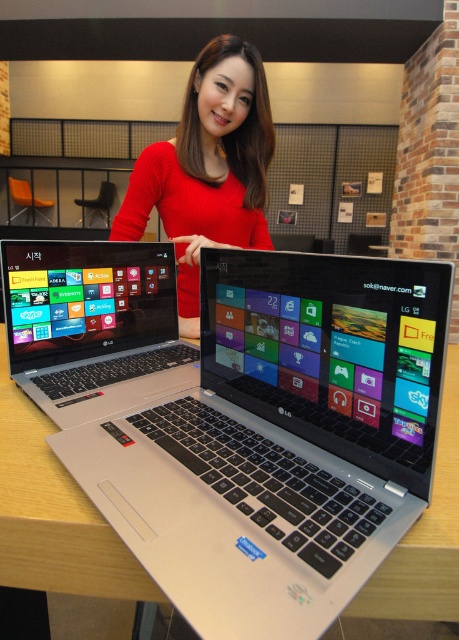
You are standing in front of the wooden table at center. You want to place a 30 cm wide book on the table. Can you fit it on the table without moving any items?

The wooden table at center and viewer are 38.18 centimeters apart. Since the book is 30 cm wide, which is less than the distance between you and the table, the book can be placed on the table.

You are a delivery person who needs to place a package on the wooden table at center. According to the image, where exactly should you place the package?

The wooden table at center is located at point (54, 515), so place the package there.